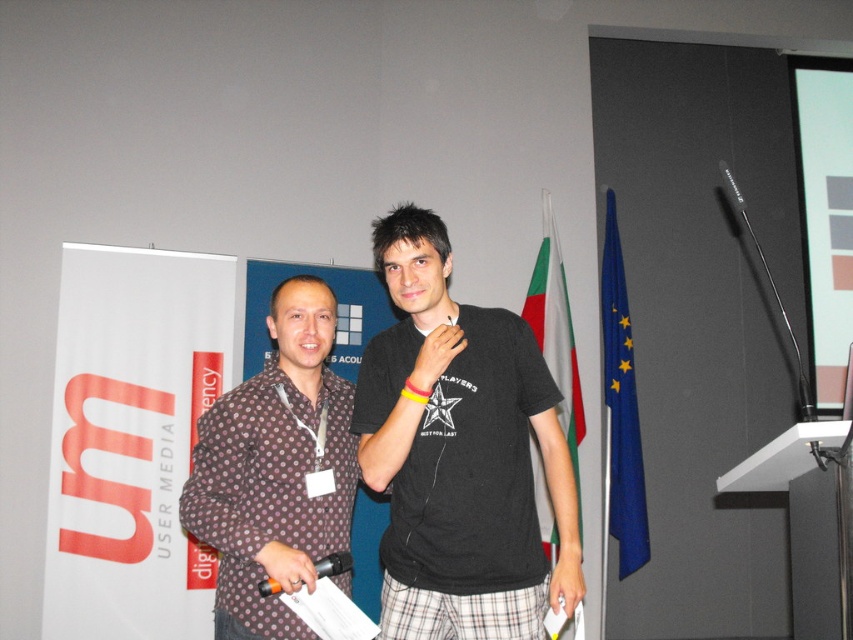
Which of these two, black cotton t-shirt at center or brown dotted shirt at left, stands shorter?

brown dotted shirt at left is shorter.

In the scene shown: Which of these two, black cotton t-shirt at center or brown dotted shirt at left, stands taller?

black cotton t-shirt at center

What do you see at coordinates (460, 452) in the screenshot?
I see `black cotton t-shirt at center` at bounding box center [460, 452].

Locate an element on the screen. The image size is (853, 640). black cotton t-shirt at center is located at coordinates pos(460,452).

Does point (392, 282) lie behind point (325, 561)?

Yes, point (392, 282) is behind point (325, 561).

Does black cotton t-shirt at center appear under orange plastic microphone at center?

No, black cotton t-shirt at center is not below orange plastic microphone at center.

Who is more distant from viewer, (535, 358) or (318, 576)?

Positioned behind is point (535, 358).

Locate an element on the screen. The height and width of the screenshot is (640, 853). black cotton t-shirt at center is located at coordinates (460, 452).

Is brown dotted shirt at left shorter than orange plastic microphone at center?

Incorrect, brown dotted shirt at left's height does not fall short of orange plastic microphone at center's.

Who is taller, brown dotted shirt at left or orange plastic microphone at center?

With more height is brown dotted shirt at left.

Is point (212, 436) in front of point (267, 589)?

No, (212, 436) is behind (267, 589).

Find the location of a particular element. brown dotted shirt at left is located at coordinates (276, 468).